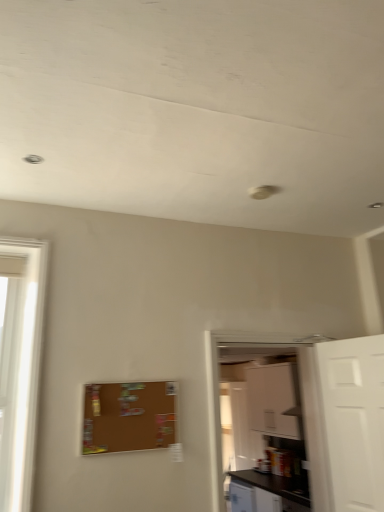
Question: Does black laminate counter top at lower right contain white glossy cabinet at right?

Choices:
 (A) no
 (B) yes

Answer: (A)

Question: Is black laminate counter top at lower right in contact with white glossy cabinet at right?

Choices:
 (A) yes
 (B) no

Answer: (B)

Question: Can you confirm if black laminate counter top at lower right is thinner than white glossy cabinet at right?

Choices:
 (A) no
 (B) yes

Answer: (A)

Question: Does black laminate counter top at lower right lie in front of white glossy cabinet at right?

Choices:
 (A) no
 (B) yes

Answer: (A)

Question: From a real-world perspective, is black laminate counter top at lower right positioned over white glossy cabinet at right based on gravity?

Choices:
 (A) yes
 (B) no

Answer: (B)

Question: Is black laminate counter top at lower right looking in the opposite direction of white glossy cabinet at right?

Choices:
 (A) no
 (B) yes

Answer: (A)

Question: Can you confirm if white matte cabinet at upper right is smaller than corkboard at center?

Choices:
 (A) no
 (B) yes

Answer: (A)

Question: Considering the relative sizes of white matte cabinet at upper right and corkboard at center in the image provided, is white matte cabinet at upper right shorter than corkboard at center?

Choices:
 (A) no
 (B) yes

Answer: (A)

Question: Are white matte cabinet at upper right and corkboard at center far apart?

Choices:
 (A) no
 (B) yes

Answer: (B)

Question: Can you confirm if white matte cabinet at upper right is wider than corkboard at center?

Choices:
 (A) yes
 (B) no

Answer: (A)

Question: From the image's perspective, is white matte cabinet at upper right under corkboard at center?

Choices:
 (A) no
 (B) yes

Answer: (B)

Question: Is white matte cabinet at upper right facing away from corkboard at center?

Choices:
 (A) no
 (B) yes

Answer: (A)

Question: Is white matte door at right oriented away from corkboard at center?

Choices:
 (A) no
 (B) yes

Answer: (A)